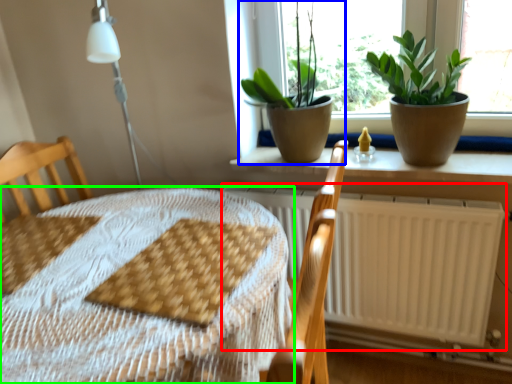
Question: Estimate the real-world distances between objects in this image. Which object is closer to radiator (highlighted by a red box), houseplant (highlighted by a blue box) or table (highlighted by a green box)?

Choices:
 (A) houseplant
 (B) table

Answer: (A)